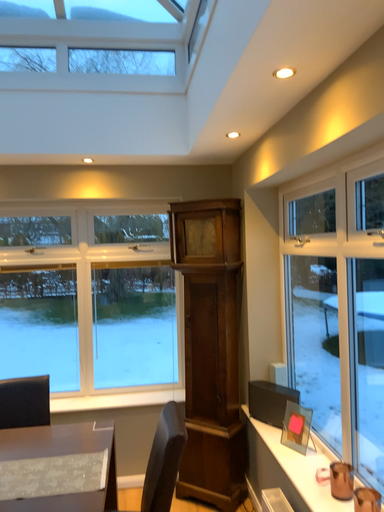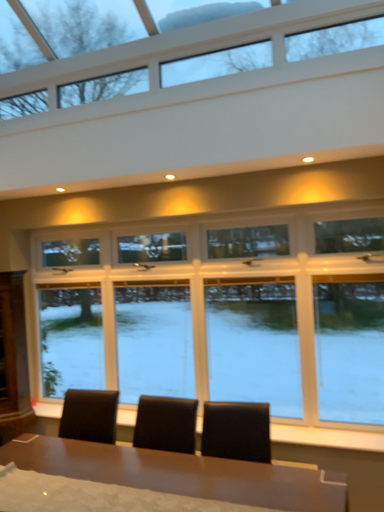
Question: How did the camera likely rotate when shooting the video?

Choices:
 (A) rotated right
 (B) rotated left

Answer: (B)